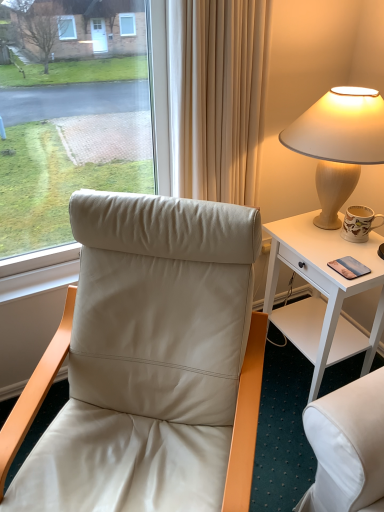
Question: Would you say matte beige lamp at upper right is part of white wood desk at right's contents?

Choices:
 (A) no
 (B) yes

Answer: (A)

Question: Considering the relative sizes of white wood desk at right and matte beige lamp at upper right in the image provided, is white wood desk at right bigger than matte beige lamp at upper right?

Choices:
 (A) no
 (B) yes

Answer: (B)

Question: Is white wood desk at right in front of matte beige lamp at upper right?

Choices:
 (A) no
 (B) yes

Answer: (A)

Question: Is white wood desk at right further to camera compared to matte beige lamp at upper right?

Choices:
 (A) yes
 (B) no

Answer: (A)

Question: Can you confirm if white wood desk at right is positioned to the right of matte beige lamp at upper right?

Choices:
 (A) no
 (B) yes

Answer: (A)

Question: In terms of height, does metallic silver phone at right look taller or shorter compared to matte ceramic mug at right?

Choices:
 (A) short
 (B) tall

Answer: (A)

Question: Is point coord(331,264) closer or farther from the camera than point coord(350,208)?

Choices:
 (A) farther
 (B) closer

Answer: (B)

Question: From the image's perspective, is metallic silver phone at right positioned above or below matte ceramic mug at right?

Choices:
 (A) above
 (B) below

Answer: (B)

Question: From a real-world perspective, is metallic silver phone at right physically located above or below matte ceramic mug at right?

Choices:
 (A) above
 (B) below

Answer: (B)

Question: From a real-world perspective, is leather at left physically located above or below white wood desk at right?

Choices:
 (A) below
 (B) above

Answer: (B)

Question: From the image's perspective, is leather at left positioned above or below white wood desk at right?

Choices:
 (A) above
 (B) below

Answer: (B)

Question: Does point (162, 359) appear closer or farther from the camera than point (276, 239)?

Choices:
 (A) farther
 (B) closer

Answer: (B)

Question: Visually, is leather at left positioned to the left or to the right of white wood desk at right?

Choices:
 (A) left
 (B) right

Answer: (A)

Question: Is metallic silver phone at right in front of or behind white wood desk at right in the image?

Choices:
 (A) front
 (B) behind

Answer: (B)

Question: Is metallic silver phone at right bigger or smaller than white wood desk at right?

Choices:
 (A) small
 (B) big

Answer: (A)